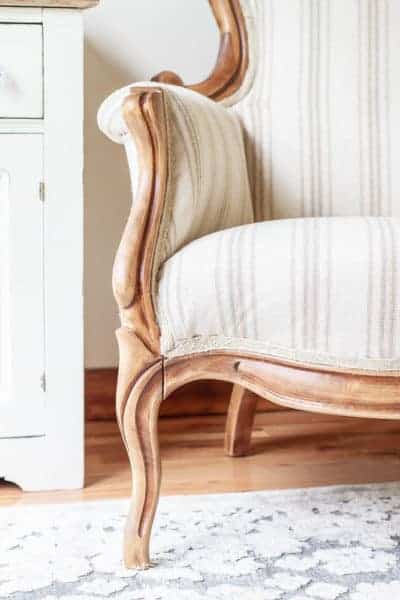
This screenshot has width=400, height=600. In order to click on cabinet in this screenshot , I will do `click(15, 286)`.